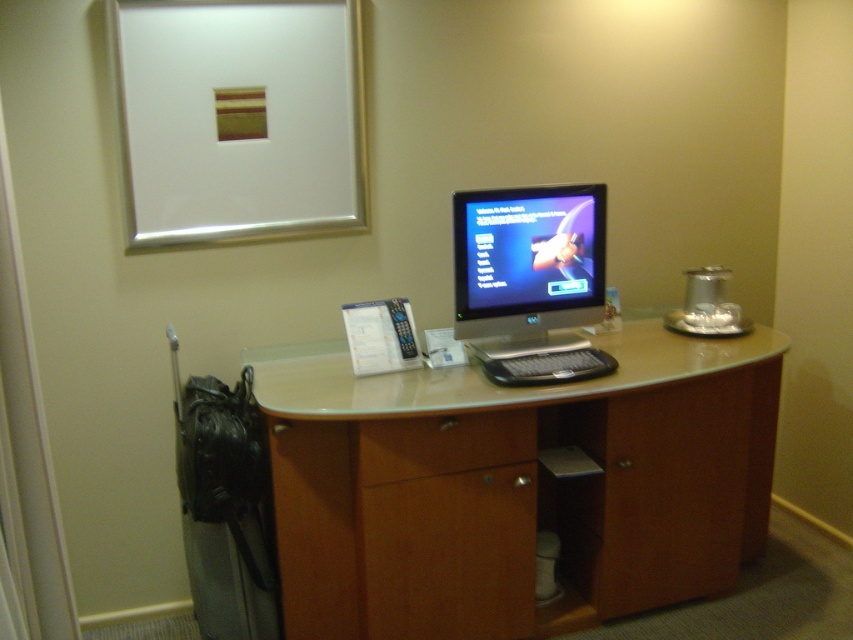
Can you confirm if satin silver monitor at center is smaller than wooden drawer at center?

Incorrect, satin silver monitor at center is not smaller in size than wooden drawer at center.

Can you confirm if satin silver monitor at center is wider than wooden drawer at center?

Incorrect, satin silver monitor at center's width does not surpass wooden drawer at center's.

Who is more forward, (576, 211) or (509, 424)?

Point (509, 424) is more forward.

You are a GUI agent. You are given a task and a screenshot of the screen. Output one action in this format:
    pyautogui.click(x=<x>, y=<y>)
    Task: Click on the satin silver monitor at center
    
    Given the screenshot: What is the action you would take?
    pyautogui.click(x=531, y=280)

Is silver metallic picture frame at upper center bigger than wooden drawer at center?

Yes, silver metallic picture frame at upper center is bigger than wooden drawer at center.

Which is more to the left, silver metallic picture frame at upper center or wooden drawer at center?

From the viewer's perspective, silver metallic picture frame at upper center appears more on the left side.

Locate an element on the screen. This screenshot has height=640, width=853. silver metallic picture frame at upper center is located at coordinates (238, 118).

Identify the location of silver metallic picture frame at upper center. The height and width of the screenshot is (640, 853). (238, 118).

Is point (619, 563) in front of point (514, 202)?

That is False.

What do you see at coordinates (514, 484) in the screenshot? I see `wooden computer desk at center` at bounding box center [514, 484].

The image size is (853, 640). In order to click on wooden computer desk at center in this screenshot , I will do `click(514, 484)`.